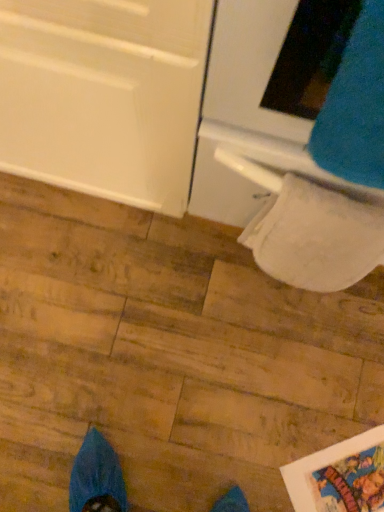
Question: Considering their positions, is blue fuzzy sweat pants at upper right located in front of or behind white textured toilet paper at lower right?

Choices:
 (A) front
 (B) behind

Answer: (A)

Question: Is point (322, 150) positioned closer to the camera than point (344, 216)?

Choices:
 (A) farther
 (B) closer

Answer: (B)

Question: Which object is the farthest from the white glossy oven at upper right?

Choices:
 (A) white textured toilet paper at lower right
 (B) blue fuzzy sweat pants at upper right

Answer: (B)

Question: Estimate the real-world distances between objects in this image. Which object is closer to the blue fuzzy sweat pants at upper right?

Choices:
 (A) white glossy oven at upper right
 (B) white textured toilet paper at lower right

Answer: (A)